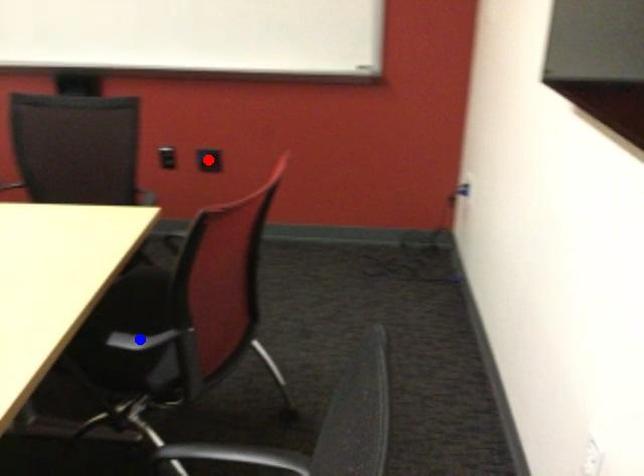
Question: Two points are marked on the image. Which point is closer to the camera?

Choices:
 (A) Blue point is closer.
 (B) Red point is closer.

Answer: (A)